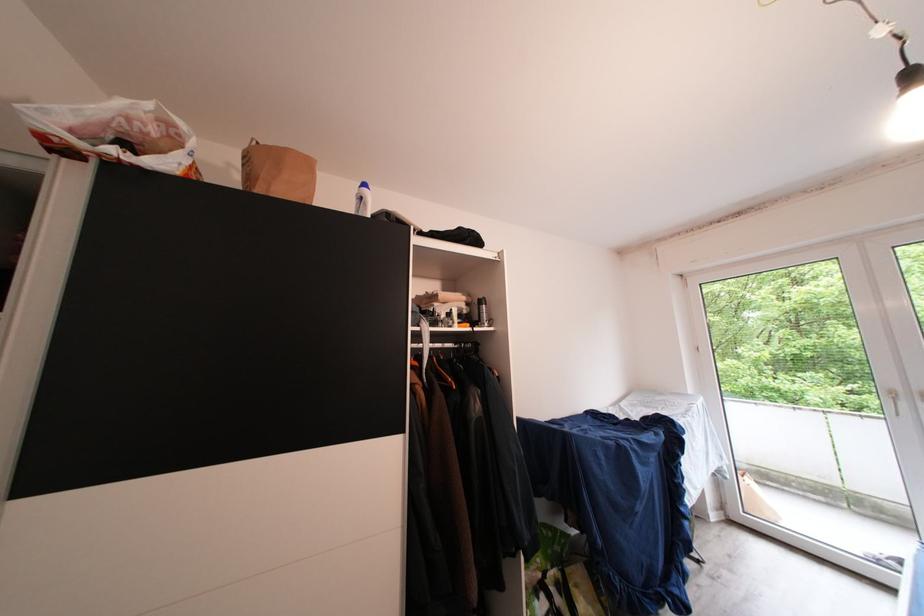
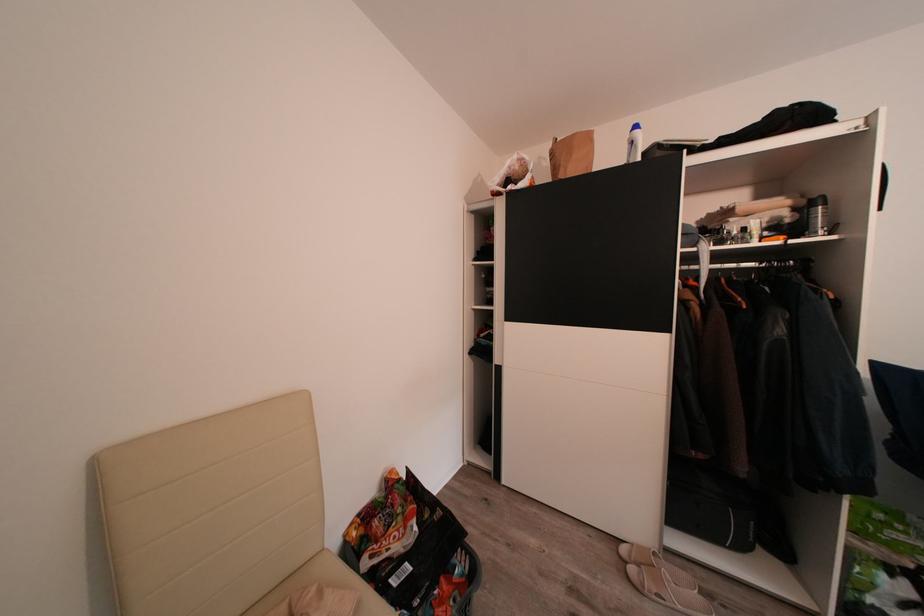
In the second image, find the point that corresponds to the point at 477,310 in the first image.

(805, 215)